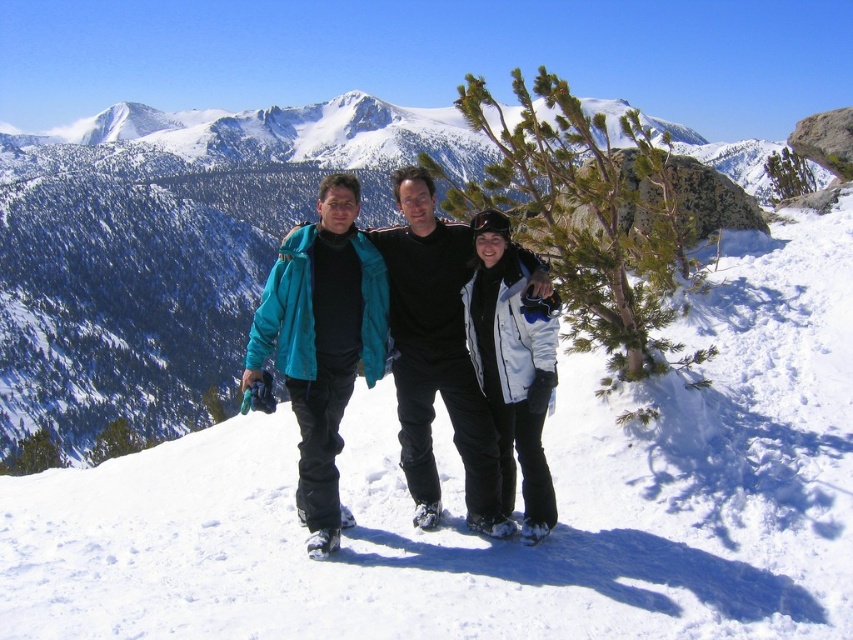
Which is more to the left, white matte jacket at center or white matte ski at lower center?

white matte ski at lower center

Locate an element on the screen. This screenshot has width=853, height=640. white matte jacket at center is located at coordinates (514, 364).

Is point (479, 372) closer to camera compared to point (332, 528)?

No, (479, 372) is further to viewer.

Identify the location of white matte jacket at center. This screenshot has width=853, height=640. (514, 364).

Which of these two, matte blue jacket at center or white matte ski at lower center, stands shorter?

white matte ski at lower center is shorter.

Is point (403, 410) less distant than point (329, 532)?

That is False.

Locate an element on the screen. This screenshot has height=640, width=853. matte blue jacket at center is located at coordinates (436, 355).

You are a GUI agent. You are given a task and a screenshot of the screen. Output one action in this format:
    pyautogui.click(x=<x>, y=<y>)
    Task: Click on the matte blue jacket at center
    
    Given the screenshot: What is the action you would take?
    pyautogui.click(x=436, y=355)

Is white snow at center bigger than white matte jacket at center?

Indeed, white snow at center has a larger size compared to white matte jacket at center.

Can you confirm if white snow at center is taller than white matte jacket at center?

Yes, white snow at center is taller than white matte jacket at center.

Is point (791, 403) in front of point (520, 276)?

No, (791, 403) is further to viewer.

At what (x,y) coordinates should I click in order to perform the action: click on white snow at center. Please return your answer as a coordinate pair (x, y). The width and height of the screenshot is (853, 640). Looking at the image, I should click on (462, 502).